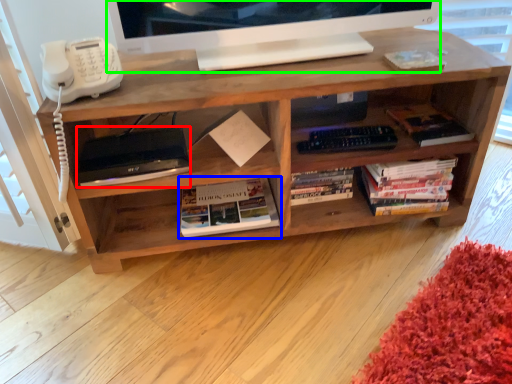
Question: Considering the real-world distances, which object is farthest from equipment (highlighted by a red box)? book (highlighted by a blue box) or television (highlighted by a green box)?

Choices:
 (A) book
 (B) television

Answer: (B)